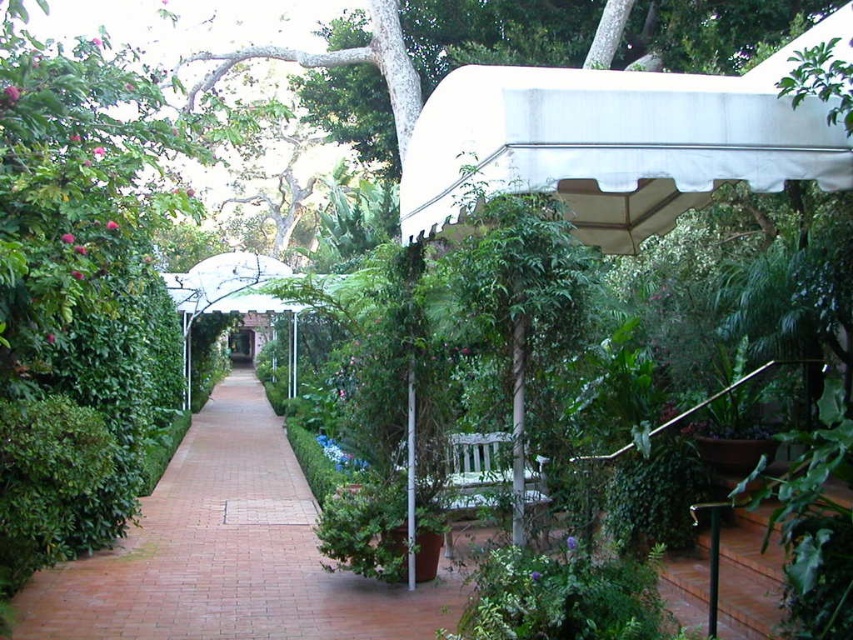
Between white fabric canopy at upper right and brick at center, which one has less height?

Standing shorter between the two is brick at center.

Does white fabric canopy at upper right appear on the right side of brick at center?

Correct, you'll find white fabric canopy at upper right to the right of brick at center.

Does point (444, 168) come behind point (270, 518)?

That is False.

The height and width of the screenshot is (640, 853). In order to click on white fabric canopy at upper right in this screenshot , I will do tap(618, 141).